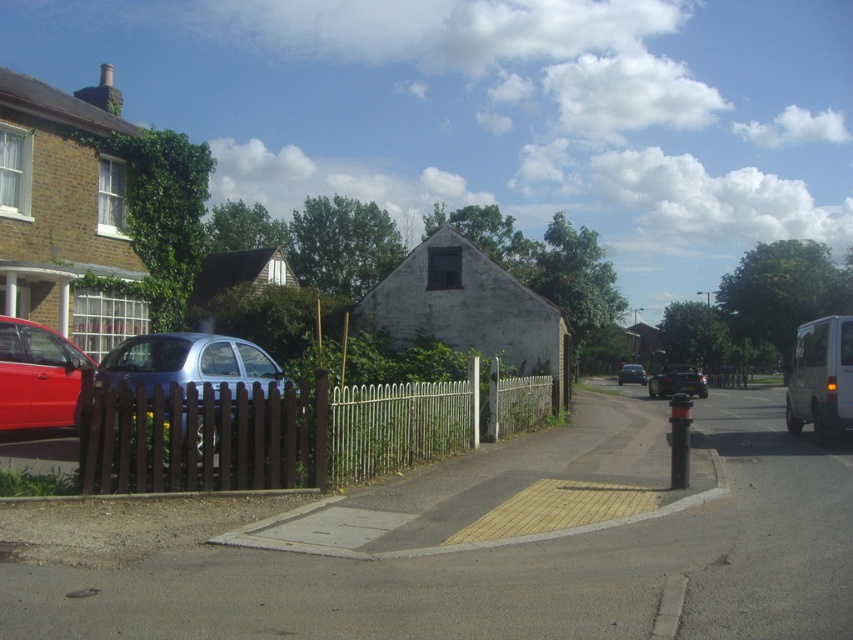
Does point (85, 467) lie in front of point (816, 339)?

That is True.

Describe the element at coordinates (265, 433) in the screenshot. I see `brown wooden fence at center` at that location.

Locate an element on the screen. brown wooden fence at center is located at coordinates (265, 433).

Locate an element on the screen. This screenshot has height=640, width=853. brown wooden fence at center is located at coordinates (265, 433).

Find the location of a particular element. Image resolution: width=853 pixels, height=640 pixels. metallic silver van at right is located at coordinates (821, 378).

Can you confirm if metallic silver van at right is smaller than metallic silver car at center?

No.

Does point (801, 380) come in front of point (636, 380)?

Yes.

You are a GUI agent. You are given a task and a screenshot of the screen. Output one action in this format:
    pyautogui.click(x=<x>, y=<y>)
    Task: Click on the metallic silver van at right
    This screenshot has height=640, width=853.
    Given the screenshot: What is the action you would take?
    pyautogui.click(x=821, y=378)

Does point (171, 380) lie behind point (689, 387)?

No, (171, 380) is closer to viewer.

Measure the distance between satin blue car at left and camera.

satin blue car at left and camera are 10.31 meters apart from each other.

Between point (222, 339) and point (675, 388), which one is positioned in front?

Point (222, 339) is more forward.

Where is `satin blue car at left`? The width and height of the screenshot is (853, 640). satin blue car at left is located at coordinates (189, 364).